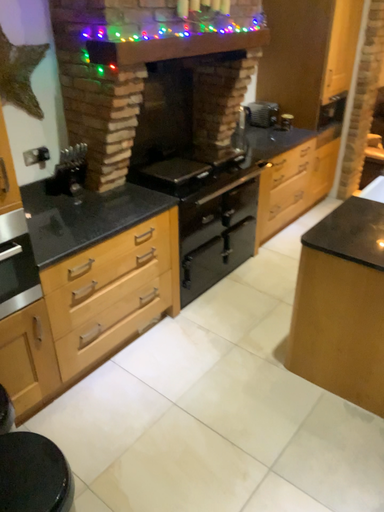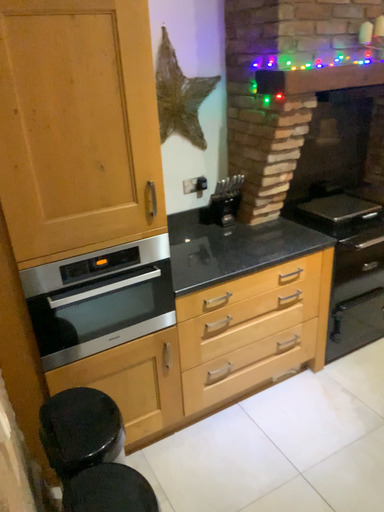
Question: How did the camera likely rotate when shooting the video?

Choices:
 (A) rotated right
 (B) rotated left

Answer: (B)